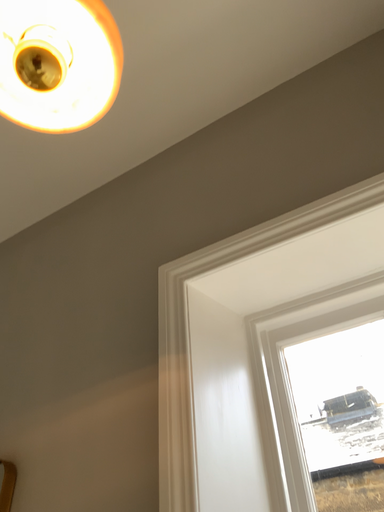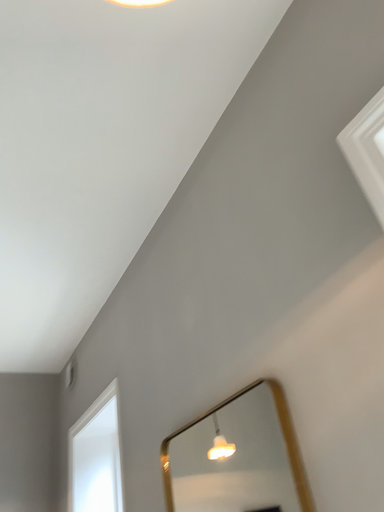
Question: Which way did the camera rotate in the video?

Choices:
 (A) rotated right
 (B) rotated left

Answer: (B)